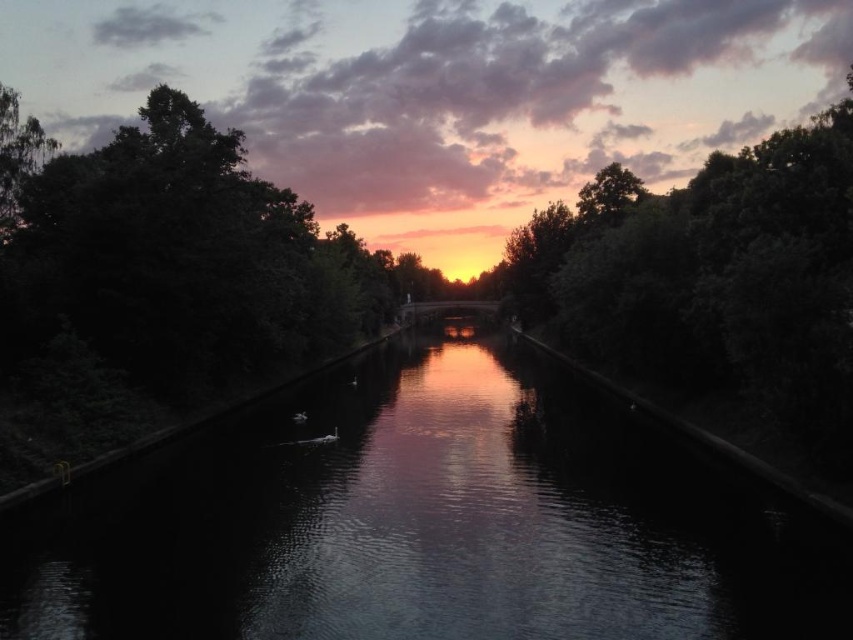
Question: Considering the real-world distances, which object is closest to the green leafy tree at upper left?

Choices:
 (A) dark reflective water at center
 (B) green leafy tree at upper center

Answer: (A)

Question: Can you confirm if dark reflective water at center is wider than green leafy tree at upper center?

Choices:
 (A) no
 (B) yes

Answer: (A)

Question: Estimate the real-world distances between objects in this image. Which object is farther from the green leafy tree at upper left?

Choices:
 (A) dark reflective water at center
 (B) green leafy tree at upper center

Answer: (B)

Question: Does dark reflective water at center appear on the right side of green leafy tree at upper center?

Choices:
 (A) yes
 (B) no

Answer: (B)

Question: Which point appears closest to the camera in this image?

Choices:
 (A) (817, 349)
 (B) (35, 141)

Answer: (A)

Question: Does dark reflective water at center appear under green leafy tree at upper left?

Choices:
 (A) no
 (B) yes

Answer: (B)